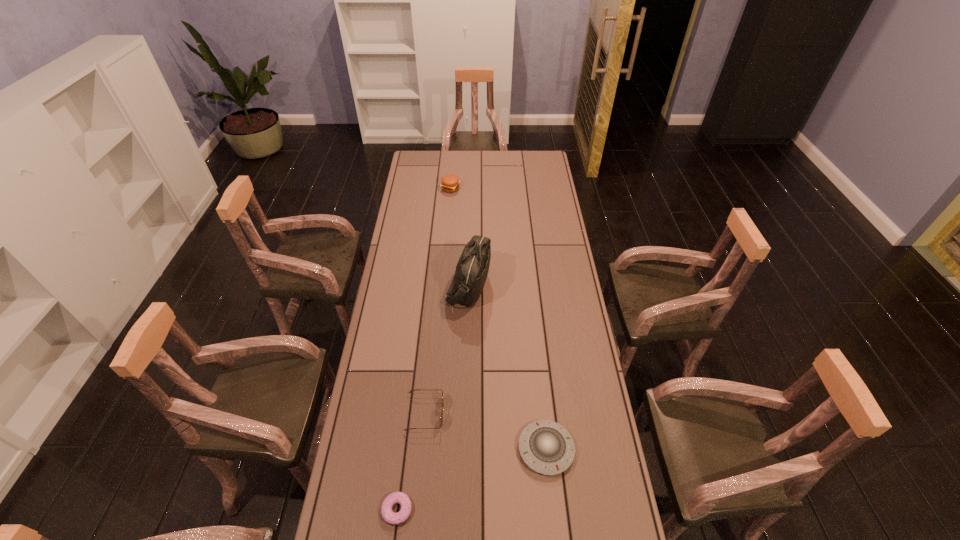
The width and height of the screenshot is (960, 540). In order to click on free point between the shortest object and the sunglasses in this screenshot , I will do tap(412, 461).

You are a GUI agent. You are given a task and a screenshot of the screen. Output one action in this format:
    pyautogui.click(x=<x>, y=<y>)
    Task: Click on the free spot between the nearest object and the fourth nearest object
    Image resolution: width=960 pixels, height=540 pixels.
    Given the screenshot: What is the action you would take?
    pyautogui.click(x=433, y=397)

Find the location of a particular element. vacant point located between the farthest object and the third tallest object is located at coordinates (438, 301).

Locate an element on the screen. vacant area between the rightmost object and the sunglasses is located at coordinates (486, 431).

This screenshot has height=540, width=960. What are the coordinates of `free space between the doughnut and the third shortest object` in the screenshot? It's located at 412,461.

Where is `vacant space in between the fourth nearest object and the shortest object`? vacant space in between the fourth nearest object and the shortest object is located at coordinates (433, 397).

Identify the location of free space between the sunglasses and the saucer. (486, 431).

This screenshot has height=540, width=960. I want to click on free point between the nearest object and the shoulder bag, so click(433, 397).

Locate an element on the screen. The width and height of the screenshot is (960, 540). unoccupied position between the farthest object and the second shortest object is located at coordinates (498, 319).

Choose which object is the third nearest neighbor to the farthest object. Please provide its 2D coordinates. Your answer should be formatted as a tuple, i.e. [(x, y)], where the tuple contains the x and y coordinates of a point satisfying the conditions above.

[(546, 447)]